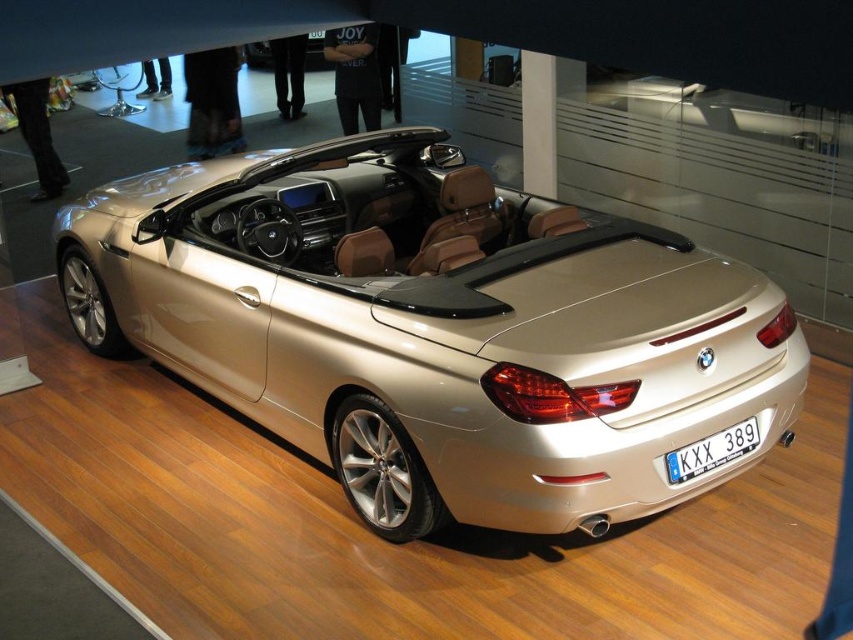
You are a photographer taking a picture of the metallic gold convertible at center and the white plastic license plate at center. Which object should you focus on first if you want to capture both in sharp focus?

The metallic gold convertible at center is above the white plastic license plate at center, so you should focus on the metallic gold convertible at center first to ensure both are in sharp focus.

In the scene shown: You are a photographer taking a picture of the metallic gold convertible at center and the white plastic license plate at center. Which object will appear bigger in the photo?

The metallic gold convertible at center will appear bigger in the photo because it is larger in size than the white plastic license plate at center.

Consider the image. You are a photographer standing 2 meters away from the metallic gold convertible at center. You want to take a photo of the white plastic license plate at center without moving the car. Can you reach the license plate by moving forward from your current position?

The metallic gold convertible at center is 1.58 meters away from the white plastic license plate at center. Since you are already 2 meters away from the convertible, moving forward 1.58 meters would bring you to the license plate, so yes, you can reach it by moving forward from your current position.